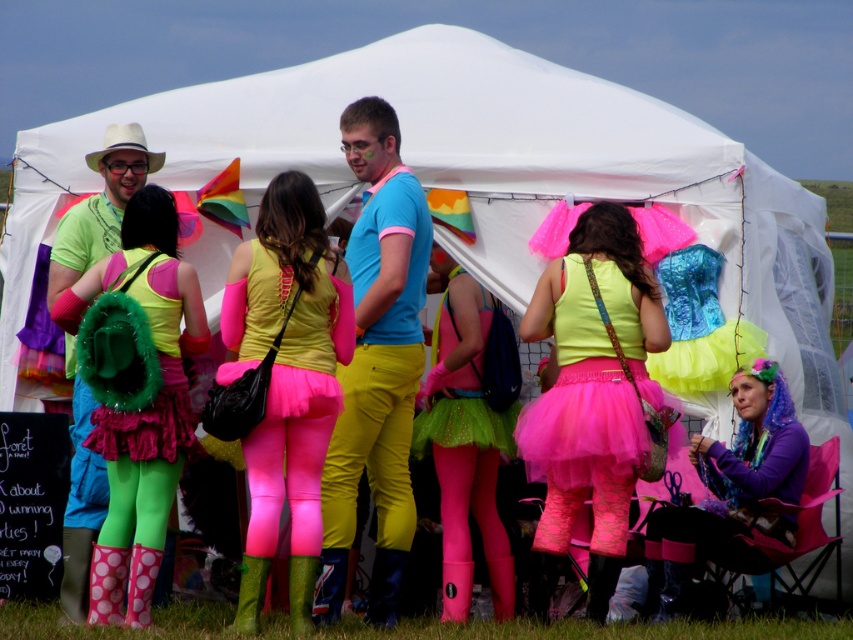
Question: Is pink tulle skirt at center to the left of matte green t-shirt at center from the viewer's perspective?

Choices:
 (A) yes
 (B) no

Answer: (B)

Question: Is pink tulle skirt at center in front of fuzzy green backpack at left?

Choices:
 (A) yes
 (B) no

Answer: (A)

Question: Which of the following is the farthest from the observer?

Choices:
 (A) (244, 561)
 (B) (149, 452)
 (C) (422, 362)

Answer: (C)

Question: Can you confirm if matte yellow tank top at center is positioned to the right of fuzzy green backpack at left?

Choices:
 (A) yes
 (B) no

Answer: (A)

Question: Which of the following is the closest to the observer?

Choices:
 (A) (111, 138)
 (B) (263, 502)

Answer: (B)

Question: Which object is positioned farthest from the white fabric cowboy hat at upper left?

Choices:
 (A) fuzzy green backpack at left
 (B) green glitter tutu at center
 (C) neon green tulle skirt at center
 (D) pink tulle skirt at center

Answer: (D)